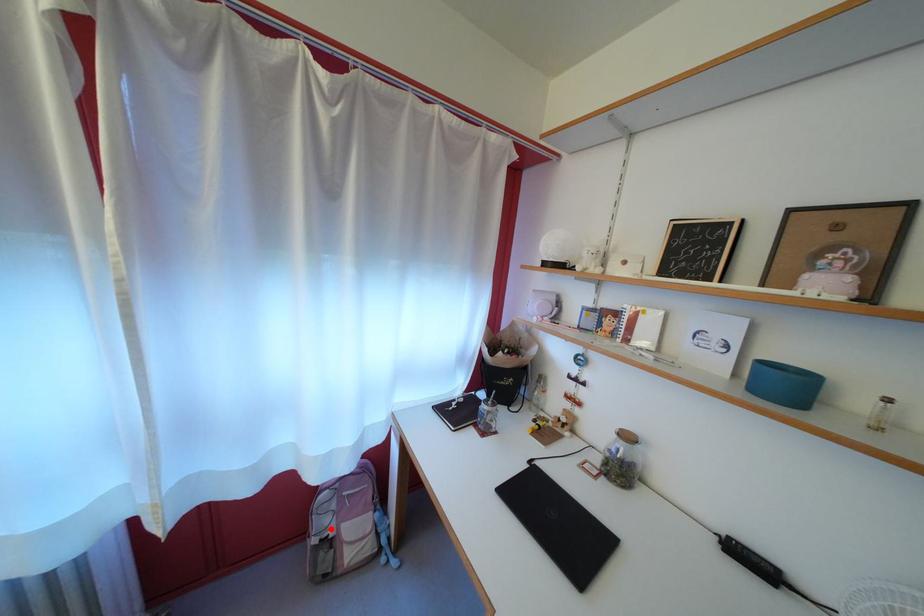
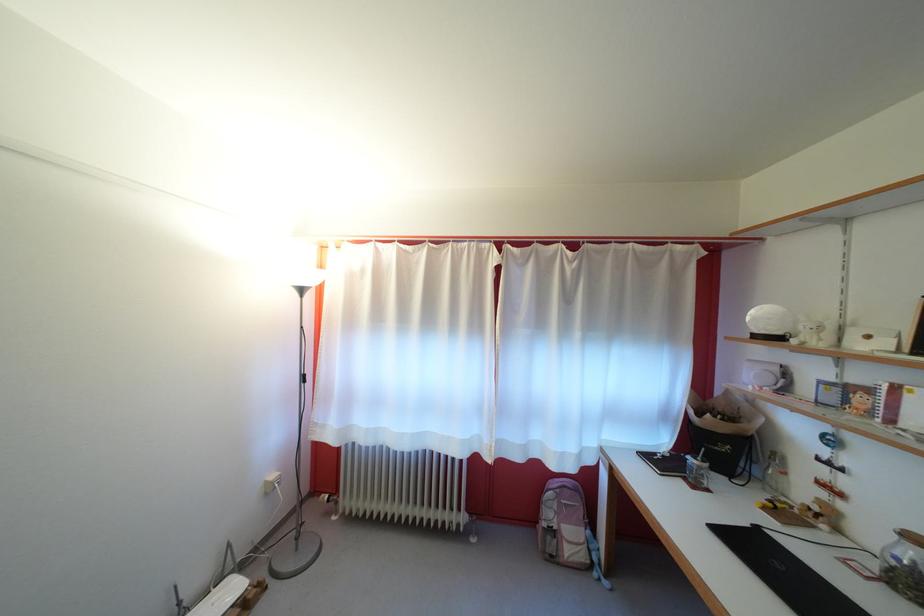
In the second image, find the point that corresponds to the highlighted location in the first image.

(556, 521)